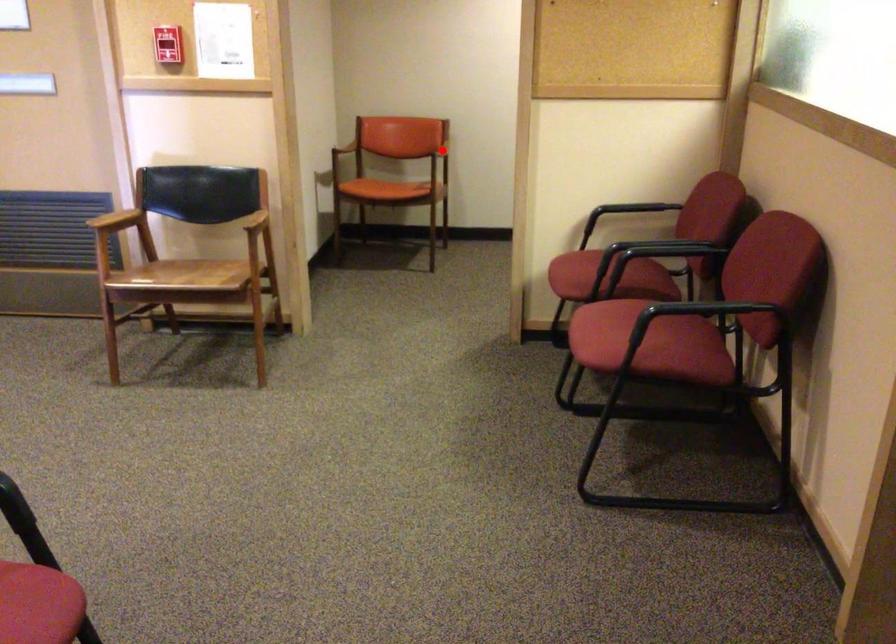
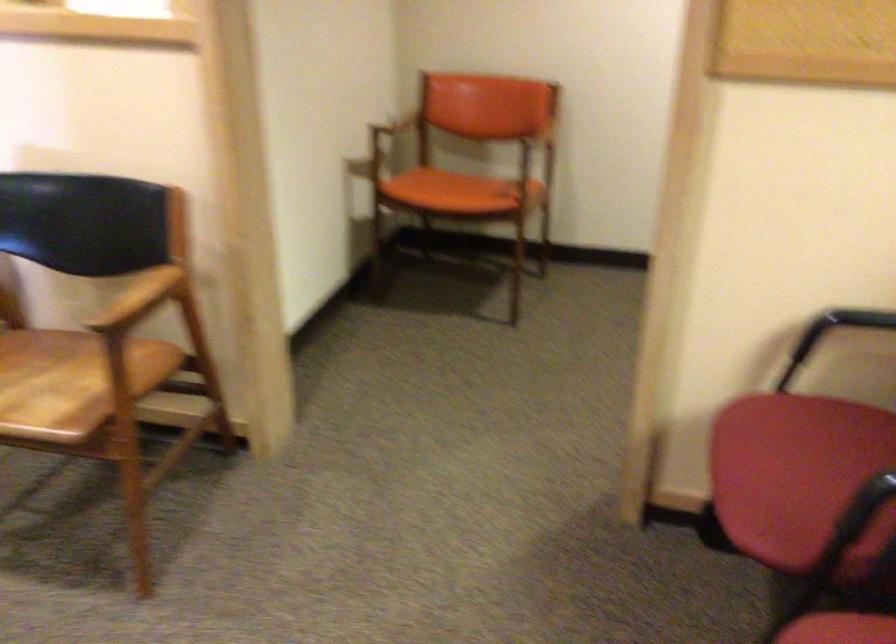
Locate, in the second image, the point that corresponds to the highlighted location in the first image.

(536, 146)